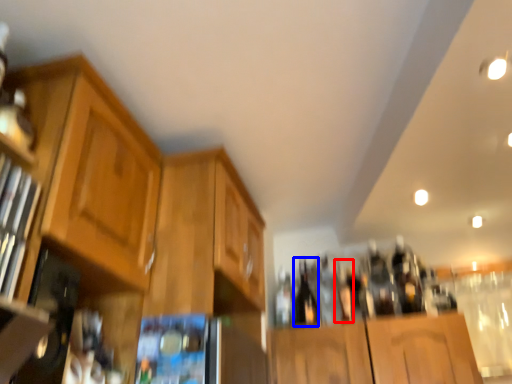
Question: Which of the following is the farthest to the observer, bottle (highlighted by a red box) or beer bottle (highlighted by a blue box)?

Choices:
 (A) bottle
 (B) beer bottle

Answer: (B)